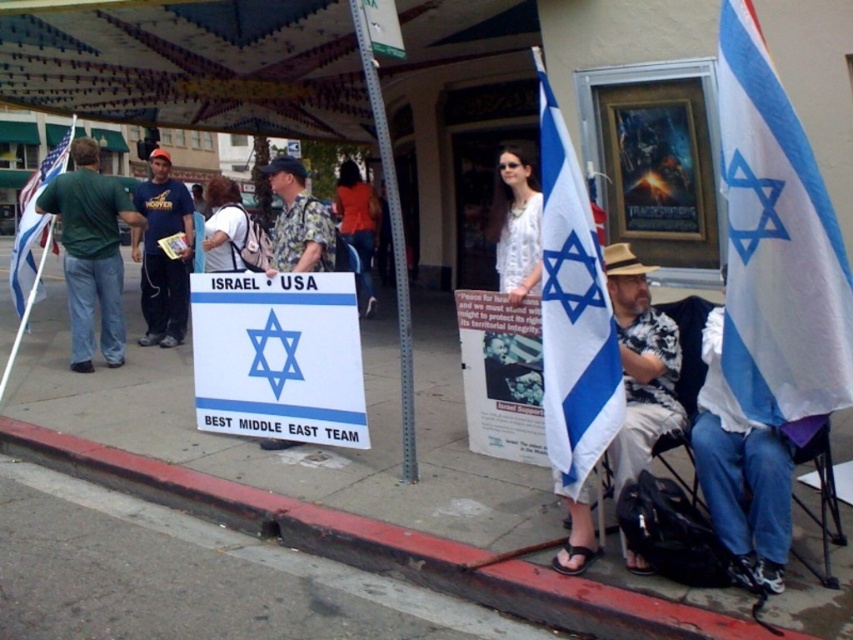
Question: Is white concrete sidewalk at lower center above orange fabric shirt at center?

Choices:
 (A) yes
 (B) no

Answer: (B)

Question: Which object is positioned farthest from the green cotton shirt at left?

Choices:
 (A) white fabric at lower right
 (B) matte blue t-shirt at center

Answer: (A)

Question: Estimate the real-world distances between objects in this image. Which object is closer to the metallic gray pole at center?

Choices:
 (A) matte blue t-shirt at center
 (B) white fabric shirt at center
 (C) white lace shirt at center
 (D) white fabric at lower right

Answer: (C)

Question: Is matte blue t-shirt at center to the left of printed fabric shirt at center from the viewer's perspective?

Choices:
 (A) yes
 (B) no

Answer: (A)

Question: Which of the following is the farthest from the observer?

Choices:
 (A) orange fabric shirt at center
 (B) blue and white fabric flag at center
 (C) green cotton shirt at left

Answer: (A)

Question: Observing the image, what is the correct spatial positioning of white fabric at lower right in reference to matte blue t-shirt at center?

Choices:
 (A) above
 (B) below

Answer: (B)